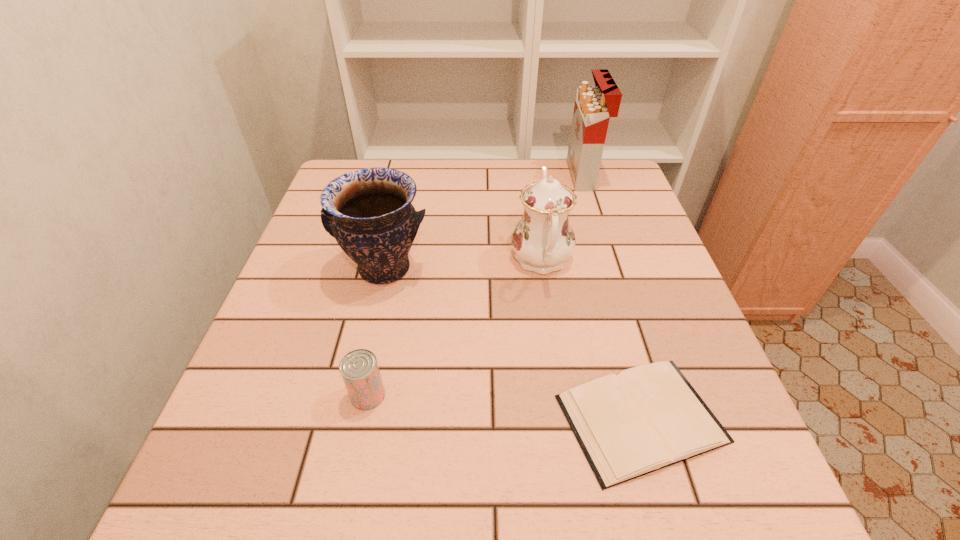
Find the location of a particular element. This screenshot has width=960, height=540. vacant space at the far edge of the desktop is located at coordinates (487, 160).

Where is `vacant space at the near edge`? This screenshot has width=960, height=540. vacant space at the near edge is located at coordinates (650, 497).

You are a GUI agent. You are given a task and a screenshot of the screen. Output one action in this format:
    pyautogui.click(x=<x>, y=<y>)
    Task: Click on the free space at the left edge of the desktop
    
    Given the screenshot: What is the action you would take?
    pyautogui.click(x=289, y=301)

Where is `free space at the right edge`? The width and height of the screenshot is (960, 540). free space at the right edge is located at coordinates (609, 212).

This screenshot has height=540, width=960. In the image, there is a desktop. In order to click on free space at the near right corner in this screenshot , I will do `click(750, 484)`.

Where is `free spot between the hardback book and the pottery`? Image resolution: width=960 pixels, height=540 pixels. free spot between the hardback book and the pottery is located at coordinates (513, 344).

What are the coordinates of `vacant space that's between the pottery and the chinaware` in the screenshot? It's located at pos(463,264).

The height and width of the screenshot is (540, 960). Identify the location of free spot between the chinaware and the fourth tallest object. (454, 327).

At what (x,y) coordinates should I click in order to perform the action: click on free spot between the hardback book and the cigarette case. Please return your answer as a coordinate pair (x, y). Looking at the image, I should click on (612, 297).

Find the location of `free spot between the tallest object and the pottery`. free spot between the tallest object and the pottery is located at coordinates (484, 222).